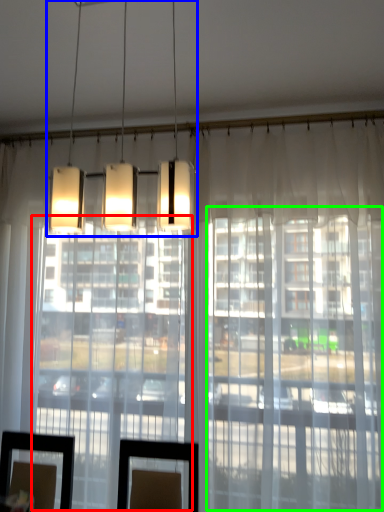
Question: Estimate the real-world distances between objects in this image. Which object is farther from glass door (highlighted by a red box), lamp (highlighted by a blue box) or glass door (highlighted by a green box)?

Choices:
 (A) lamp
 (B) glass door

Answer: (A)